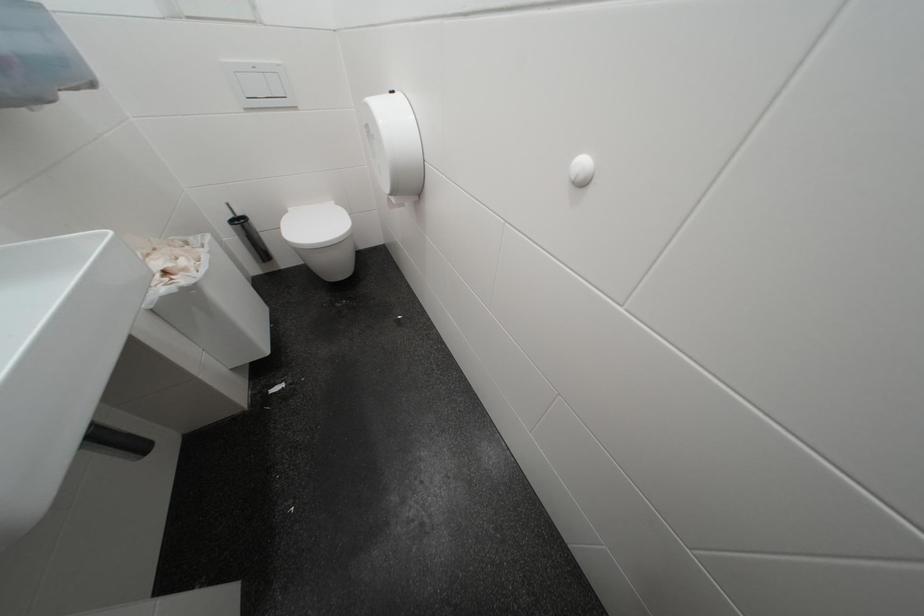
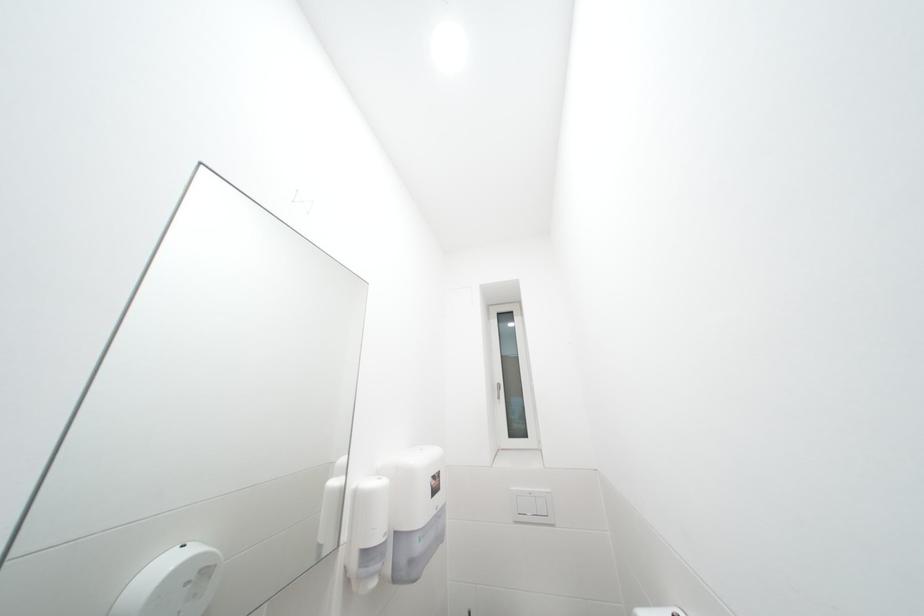
How did the camera likely rotate?

The camera rotated toward left-up.